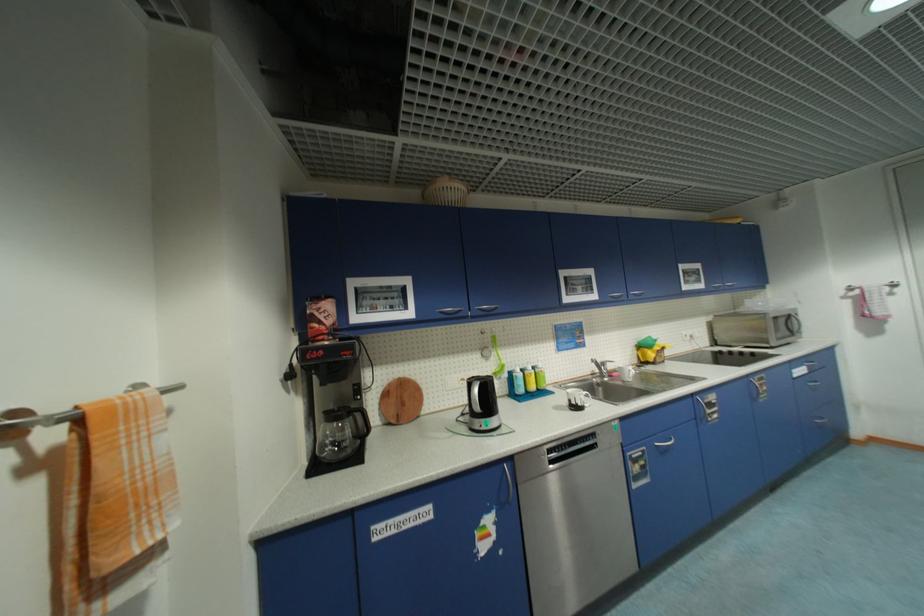
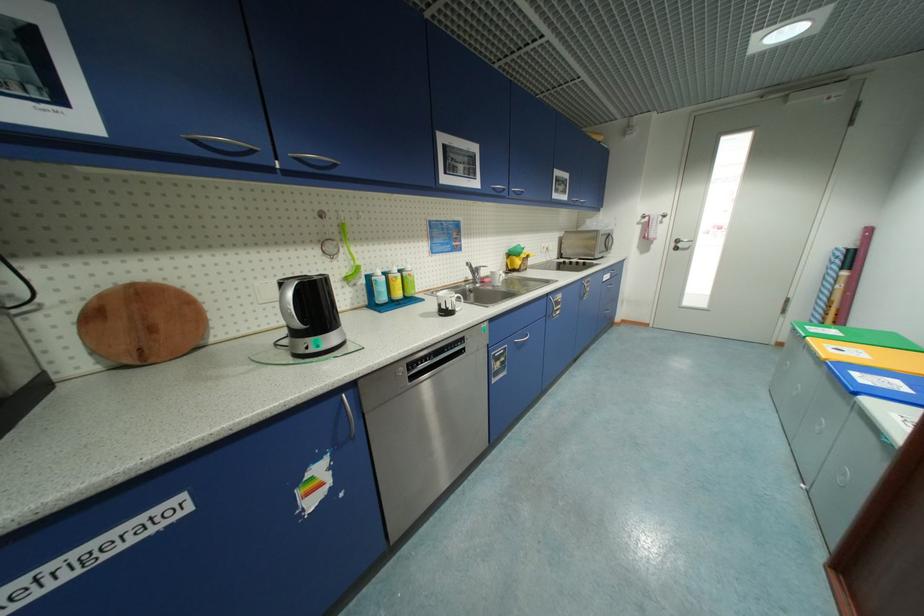
Locate, in the second image, the point that corresponds to point 499,354 in the first image.

(347, 251)